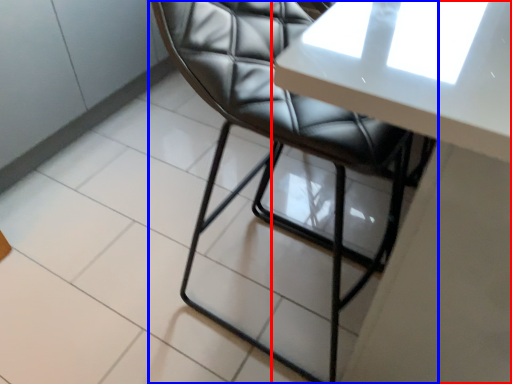
Question: Which object is further to the camera taking this photo, table (highlighted by a red box) or chair (highlighted by a blue box)?

Choices:
 (A) table
 (B) chair

Answer: (B)